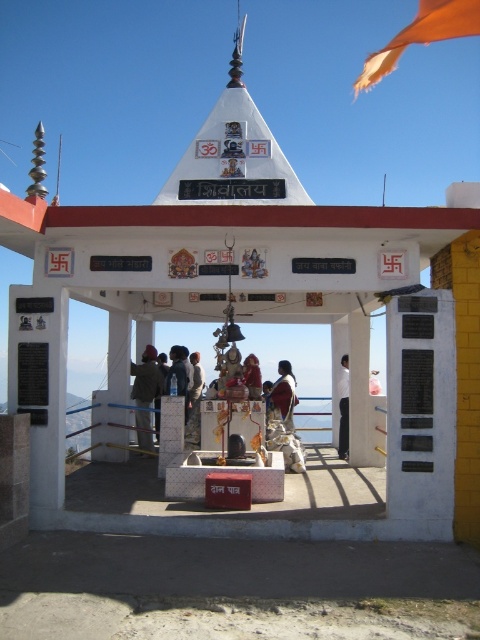
Is white fabric at center to the left of matte gold statue at center from the viewer's perspective?

In fact, white fabric at center is to the right of matte gold statue at center.

Can you confirm if white fabric at center is positioned below matte gold statue at center?

Yes.

Which is in front, point (343, 435) or point (255, 371)?

Point (255, 371) is more forward.

Find the location of `white fabric at center`. white fabric at center is located at coordinates (344, 408).

Is dark brown jacket at center positioned before white fabric at center?

Yes.

Can you confirm if dark brown jacket at center is positioned to the left of white fabric at center?

Yes, dark brown jacket at center is to the left of white fabric at center.

You are a GUI agent. You are given a task and a screenshot of the screen. Output one action in this format:
    pyautogui.click(x=<x>, y=<y>)
    Task: Click on the dark brown jacket at center
    The height and width of the screenshot is (640, 480).
    Given the screenshot: What is the action you would take?
    pyautogui.click(x=145, y=394)

Where is `dark brown jacket at center`? The image size is (480, 640). dark brown jacket at center is located at coordinates (145, 394).

Who is positioned more to the right, brown fabric saree at center or white fabric at center?

From the viewer's perspective, white fabric at center appears more on the right side.

Does brown fabric saree at center have a larger size compared to white fabric at center?

Correct, brown fabric saree at center is larger in size than white fabric at center.

Locate an element on the screen. brown fabric saree at center is located at coordinates (284, 394).

Image resolution: width=480 pixels, height=640 pixels. What are the coordinates of `brown fabric saree at center` in the screenshot? It's located at (284, 394).